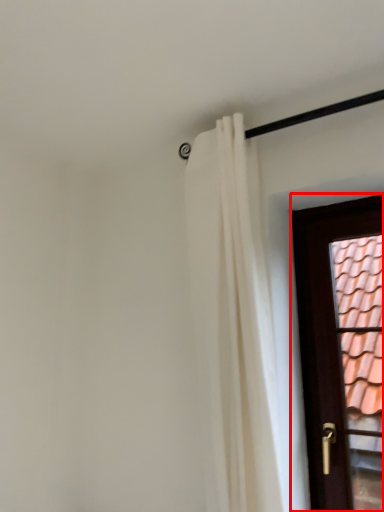
Question: From the image's perspective, considering the relative positions of door (annotated by the red box) and curtain in the image provided, where is door (annotated by the red box) located with respect to the staircase?

Choices:
 (A) below
 (B) above

Answer: (A)